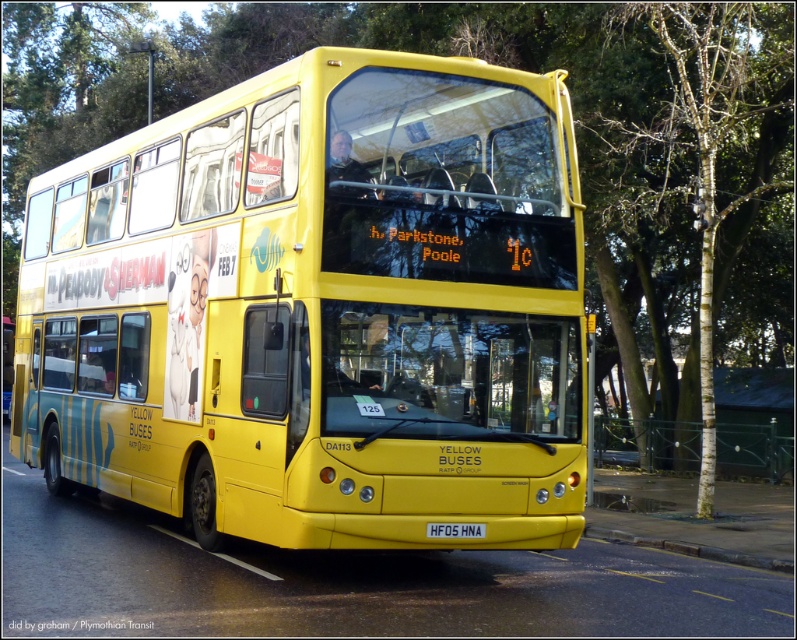
Question: Is concrete at lower right to the left of yellow plastic license plate at center from the viewer's perspective?

Choices:
 (A) yes
 (B) no

Answer: (B)

Question: Estimate the real-world distances between objects in this image. Which object is closer to the yellow plastic license plate at center?

Choices:
 (A) yellow matte/deck bus at center
 (B) concrete at lower right

Answer: (A)

Question: Which is nearer to the yellow matte/deck bus at center?

Choices:
 (A) yellow plastic license plate at center
 (B) concrete at lower right

Answer: (A)

Question: Does yellow matte/deck bus at center come in front of concrete at lower right?

Choices:
 (A) yes
 (B) no

Answer: (A)

Question: Which point appears closest to the camera in this image?

Choices:
 (A) [x=768, y=564]
 (B) [x=466, y=525]

Answer: (B)

Question: Does yellow matte/deck bus at center lie behind concrete at lower right?

Choices:
 (A) yes
 (B) no

Answer: (B)